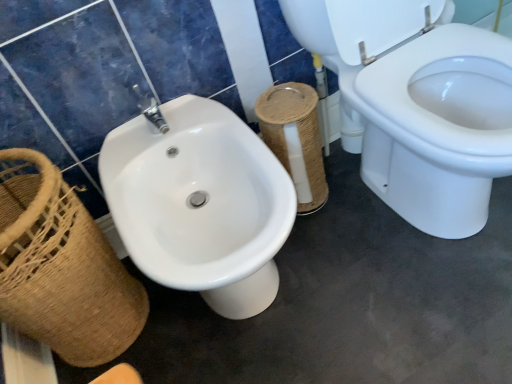
Question: Considering their positions, is woven brown toilet paper at center located in front of or behind brown woven basket at left?

Choices:
 (A) behind
 (B) front

Answer: (A)

Question: Do you think woven brown toilet paper at center is within brown woven basket at left, or outside of it?

Choices:
 (A) inside
 (B) outside

Answer: (B)

Question: Does point (264, 125) appear closer or farther from the camera than point (27, 231)?

Choices:
 (A) closer
 (B) farther

Answer: (B)

Question: Considering the positions of brown woven basket at left and woven brown toilet paper at center in the image, is brown woven basket at left bigger or smaller than woven brown toilet paper at center?

Choices:
 (A) big
 (B) small

Answer: (A)

Question: Is brown woven basket at left wider or thinner than woven brown toilet paper at center?

Choices:
 (A) thin
 (B) wide

Answer: (B)

Question: Considering their positions, is brown woven basket at left located in front of or behind woven brown toilet paper at center?

Choices:
 (A) front
 (B) behind

Answer: (A)

Question: Is brown woven basket at left to the left or to the right of woven brown toilet paper at center in the image?

Choices:
 (A) left
 (B) right

Answer: (A)